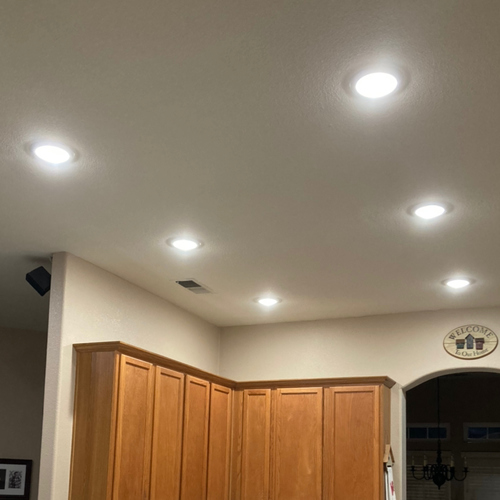
Find the location of a particular element. walls is located at coordinates (462, 403), (366, 341), (124, 321), (15, 365).